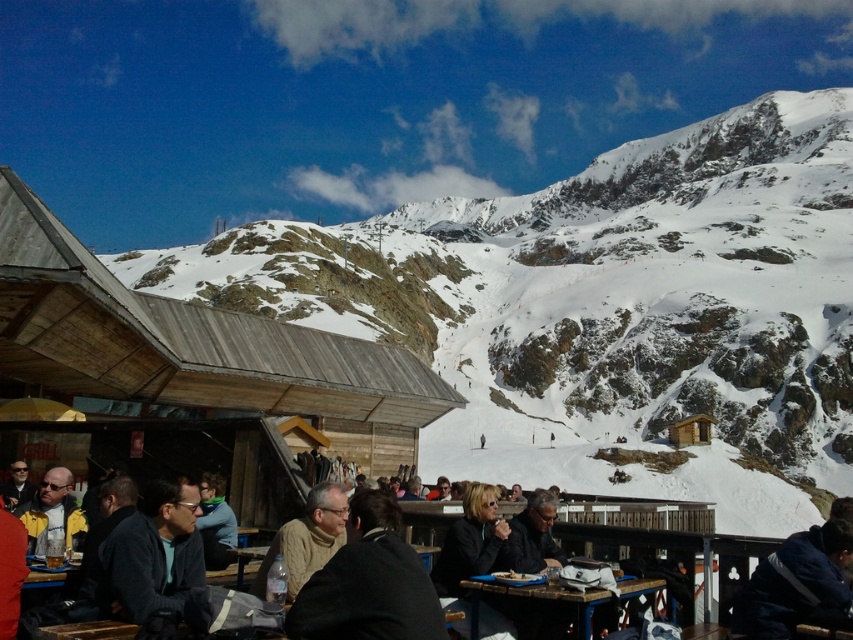
You are a photographer standing at the mountain ski resort. You want to take a photo of the two people wearing the dark gray sweater at lower left and the yellow jacket at lower left. Since you want to focus on their clothing, which clothing item should you zoom in on to capture more details?

The dark gray sweater at lower left is wider than the yellow jacket at lower left, so you should zoom in on the dark gray sweater at lower left to capture more details since it has a larger surface area.

You are standing at the entrance of the ski resort and want to find the wooden hut at center. According to the map, your current position is at point 0.0, 0.0. The wooden hut at center is located at point (194, 346). Which direction should you head to reach it?

The wooden hut at center is located at point (194, 346), so you should head northeast from your current position at 0.0, 0.0 to reach it.